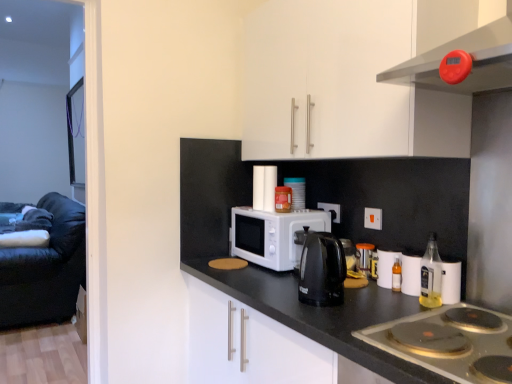
In order to face black granite countertop at center, should I rotate leftwards or rightwards?

Rotate your view right by about 9.719°.

In order to click on black granite countertop at center in this screenshot , I will do `click(322, 315)`.

The width and height of the screenshot is (512, 384). I want to click on translucent plastic bottle at lower right, which is the 1th appliance from right to left, so click(x=386, y=267).

The width and height of the screenshot is (512, 384). What do you see at coordinates (272, 235) in the screenshot? I see `white matte microwave at center` at bounding box center [272, 235].

In order to face white matte microwave at center, should I rotate leftwards or rightwards?

Rotate your view right by about 2.882°.

Identify the location of black granite countertop at center. (322, 315).

Considering the relative sizes of orange plastic electric outlet at upper center, placed as the 2th electric outlet when sorted from left to right, and white plastic electric outlet at center, which is counted as the 2th electric outlet, starting from the front, in the image provided, is orange plastic electric outlet at upper center, placed as the 2th electric outlet when sorted from left to right, bigger than white plastic electric outlet at center, which is counted as the 2th electric outlet, starting from the front,?

No.

Based on the photo, what's the angular difference between orange plastic electric outlet at upper center, placed as the 2th electric outlet when sorted from left to right, and white plastic electric outlet at center, the 1th electric outlet viewed from the back,'s facing directions?

0.00548 degrees separate the facing orientations of orange plastic electric outlet at upper center, placed as the 2th electric outlet when sorted from left to right, and white plastic electric outlet at center, the 1th electric outlet viewed from the back.

Consider the image. From a real-world perspective, between orange plastic electric outlet at upper center, placed as the 2th electric outlet when sorted from left to right, and white plastic electric outlet at center, which is counted as the 2th electric outlet, starting from the front, who is vertically higher?

white plastic electric outlet at center, which is counted as the 2th electric outlet, starting from the front.

Consider the image. From the image's perspective, is orange plastic electric outlet at upper center, which ranks as the 1th electric outlet in right-to-left order, located above white plastic electric outlet at center, positioned as the first electric outlet in left-to-right order?

No, from the image's perspective, orange plastic electric outlet at upper center, which ranks as the 1th electric outlet in right-to-left order, is not over white plastic electric outlet at center, positioned as the first electric outlet in left-to-right order.

Considering the relative sizes of orange plastic electric outlet at upper center, placed as the 2th electric outlet when sorted from left to right, and silver metallic gas stove at lower right in the image provided, is orange plastic electric outlet at upper center, placed as the 2th electric outlet when sorted from left to right, wider than silver metallic gas stove at lower right?

In fact, orange plastic electric outlet at upper center, placed as the 2th electric outlet when sorted from left to right, might be narrower than silver metallic gas stove at lower right.

Between orange plastic electric outlet at upper center, arranged as the 1th electric outlet when viewed from the front, and silver metallic gas stove at lower right, which one is positioned in front?

Positioned in front is silver metallic gas stove at lower right.

Who is smaller, orange plastic electric outlet at upper center, which is counted as the 2th electric outlet, starting from the back, or silver metallic gas stove at lower right?

Smaller between the two is orange plastic electric outlet at upper center, which is counted as the 2th electric outlet, starting from the back.

Between orange plastic electric outlet at upper center, arranged as the 1th electric outlet when viewed from the front, and silver metallic gas stove at lower right, which one appears on the right side from the viewer's perspective?

From the viewer's perspective, silver metallic gas stove at lower right appears more on the right side.

Would you consider white matte microwave at center to be distant from orange plastic electric outlet at upper center, which ranks as the 1th electric outlet in right-to-left order?

No, white matte microwave at center is in close proximity to orange plastic electric outlet at upper center, which ranks as the 1th electric outlet in right-to-left order.

In the scene shown: From the image's perspective, relative to orange plastic electric outlet at upper center, which ranks as the 1th electric outlet in right-to-left order, is white matte microwave at center above or below?

Based on their image positions, white matte microwave at center is located beneath orange plastic electric outlet at upper center, which ranks as the 1th electric outlet in right-to-left order.

Between white matte microwave at center and orange plastic electric outlet at upper center, which ranks as the 1th electric outlet in right-to-left order, which one has smaller size?

orange plastic electric outlet at upper center, which ranks as the 1th electric outlet in right-to-left order, is smaller.

Is orange plastic electric outlet at upper center, placed as the 2th electric outlet when sorted from left to right, not near translucent glass bottle at right?

No, there isn't a large distance between orange plastic electric outlet at upper center, placed as the 2th electric outlet when sorted from left to right, and translucent glass bottle at right.

From the image's perspective, is orange plastic electric outlet at upper center, which is counted as the 2th electric outlet, starting from the back, above or below translucent glass bottle at right?

Based on their image positions, orange plastic electric outlet at upper center, which is counted as the 2th electric outlet, starting from the back, is located above translucent glass bottle at right.

Between orange plastic electric outlet at upper center, which is counted as the 2th electric outlet, starting from the back, and translucent glass bottle at right, which one appears on the left side from the viewer's perspective?

From the viewer's perspective, orange plastic electric outlet at upper center, which is counted as the 2th electric outlet, starting from the back, appears more on the left side.

From a real-world perspective, which object stands above the other?

orange plastic electric outlet at upper center, arranged as the 1th electric outlet when viewed from the front.

Based on the photo, is orange plastic electric outlet at upper center, which is counted as the 2th electric outlet, starting from the back, smaller than white matte microwave at center?

Yes.

Is orange plastic electric outlet at upper center, which ranks as the 1th electric outlet in right-to-left order, not near white matte microwave at center?

No.

In terms of height, does orange plastic electric outlet at upper center, which ranks as the 1th electric outlet in right-to-left order, look taller or shorter compared to white matte microwave at center?

In the image, orange plastic electric outlet at upper center, which ranks as the 1th electric outlet in right-to-left order, appears to be shorter than white matte microwave at center.

Is orange plastic electric outlet at upper center, placed as the 2th electric outlet when sorted from left to right, facing towards white matte microwave at center?

No.

Between translucent plastic bottle at lower right, which ranks as the 2th appliance in left-to-right order, and white plastic electric outlet at center, positioned as the first electric outlet in left-to-right order, which one appears on the left side from the viewer's perspective?

From the viewer's perspective, white plastic electric outlet at center, positioned as the first electric outlet in left-to-right order, appears more on the left side.

From the image's perspective, between translucent plastic bottle at lower right, the 1th appliance from the bottom, and white plastic electric outlet at center, arranged as the 2th electric outlet when viewed from the right, who is located below?

translucent plastic bottle at lower right, the 1th appliance from the bottom, is shown below in the image.

Would you consider translucent plastic bottle at lower right, the second appliance from the top, to be distant from white plastic electric outlet at center, positioned as the first electric outlet in left-to-right order?

translucent plastic bottle at lower right, the second appliance from the top, is near white plastic electric outlet at center, positioned as the first electric outlet in left-to-right order, not far away.

Relative to white plastic electric outlet at center, arranged as the 2th electric outlet when viewed from the right, is translucent plastic bottle at lower right, marked as the second appliance in a back-to-front arrangement, in front or behind?

In the image, translucent plastic bottle at lower right, marked as the second appliance in a back-to-front arrangement, appears in front of white plastic electric outlet at center, arranged as the 2th electric outlet when viewed from the right.

Is point (429, 271) less distant than point (374, 223)?

Yes, it is in front of point (374, 223).

Between translucent glass bottle at right and orange plastic electric outlet at upper center, placed as the 2th electric outlet when sorted from left to right, which one has larger width?

translucent glass bottle at right is wider.

Is translucent glass bottle at right situated inside orange plastic electric outlet at upper center, which ranks as the 1th electric outlet in right-to-left order, or outside?

translucent glass bottle at right cannot be found inside orange plastic electric outlet at upper center, which ranks as the 1th electric outlet in right-to-left order.

Does translucent glass bottle at right have a greater height compared to orange plastic electric outlet at upper center, which is counted as the 2th electric outlet, starting from the back?

Correct, translucent glass bottle at right is much taller as orange plastic electric outlet at upper center, which is counted as the 2th electric outlet, starting from the back.

I want to click on electric outlet in front of the white plastic electric outlet at center, the 1th electric outlet viewed from the back, so click(x=373, y=218).

Locate an element on the screen. the 1st electric outlet above the silver metallic gas stove at lower right (from the image's perspective) is located at coordinates (373, 218).

When comparing their distances from translucent plastic bottle at lower right, the 1th appliance from the front, does black plastic kettle at center or white plastic electric outlet at center, positioned as the first electric outlet in left-to-right order, seem further?

white plastic electric outlet at center, positioned as the first electric outlet in left-to-right order, lies further to translucent plastic bottle at lower right, the 1th appliance from the front, than the other object.

Based on their spatial positions, is white plastic electric outlet at center, which is counted as the 2th electric outlet, starting from the front, or silver metallic gas stove at lower right further from orange plastic electric outlet at upper center, which ranks as the 1th electric outlet in right-to-left order?

Among the two, silver metallic gas stove at lower right is located further to orange plastic electric outlet at upper center, which ranks as the 1th electric outlet in right-to-left order.

Estimate the real-world distances between objects in this image. Which object is further from white plastic electric outlet at center, positioned as the first electric outlet in left-to-right order, velvet black couch at left or black plastic kettle at center?

velvet black couch at left lies further to white plastic electric outlet at center, positioned as the first electric outlet in left-to-right order, than the other object.

From the image, which object appears to be farther from translucent plastic bottle at lower right, which ranks as the 2th appliance in left-to-right order, translucent plastic container at center, acting as the first appliance starting from the back, or black granite countertop at center?

The object further to translucent plastic bottle at lower right, which ranks as the 2th appliance in left-to-right order, is translucent plastic container at center, acting as the first appliance starting from the back.

Looking at this image, from the image, which object appears to be nearer to translucent glass bottle at right, white plastic electric outlet at center, which is counted as the 2th electric outlet, starting from the front, or translucent plastic bottle at lower right, the second appliance from the top?

translucent plastic bottle at lower right, the second appliance from the top, lies closer to translucent glass bottle at right than the other object.

Based on the photo, based on their spatial positions, is translucent plastic bottle at lower right, which ranks as the 2th appliance in left-to-right order, or white matte microwave at center further from white plastic electric outlet at center, which is counted as the 2th electric outlet, starting from the front?

Among the two, translucent plastic bottle at lower right, which ranks as the 2th appliance in left-to-right order, is located further to white plastic electric outlet at center, which is counted as the 2th electric outlet, starting from the front.

Estimate the real-world distances between objects in this image. Which object is further from white plastic electric outlet at center, positioned as the first electric outlet in left-to-right order, translucent plastic bottle at lower right, which ranks as the 2th appliance in left-to-right order, or translucent glass bottle at right?

translucent glass bottle at right is further to white plastic electric outlet at center, positioned as the first electric outlet in left-to-right order.

Based on their spatial positions, is translucent plastic bottle at lower right, the 1th appliance from the bottom, or orange plastic electric outlet at upper center, which is counted as the 2th electric outlet, starting from the back, closer to translucent plastic container at center, placed as the 2th appliance when sorted from front to back?

Among the two, orange plastic electric outlet at upper center, which is counted as the 2th electric outlet, starting from the back, is located nearer to translucent plastic container at center, placed as the 2th appliance when sorted from front to back.

Identify the location of kitchen appliance between white glossy cabinet at upper center and translucent plastic bottle at lower right, which is the 1th appliance from right to left, in the vertical direction. Image resolution: width=512 pixels, height=384 pixels. (322, 270).

Identify the location of kitchen appliance between white glossy cabinet at upper center and black granite countertop at center vertically. (322, 270).

Where is `microwave oven between velvet black couch at left and orange plastic electric outlet at upper center, placed as the 2th electric outlet when sorted from left to right, in the horizontal direction`? The image size is (512, 384). microwave oven between velvet black couch at left and orange plastic electric outlet at upper center, placed as the 2th electric outlet when sorted from left to right, in the horizontal direction is located at coordinates (272, 235).

I want to click on gas stove located between black granite countertop at center and white plastic electric outlet at center, positioned as the first electric outlet in left-to-right order, in the depth direction, so click(445, 345).